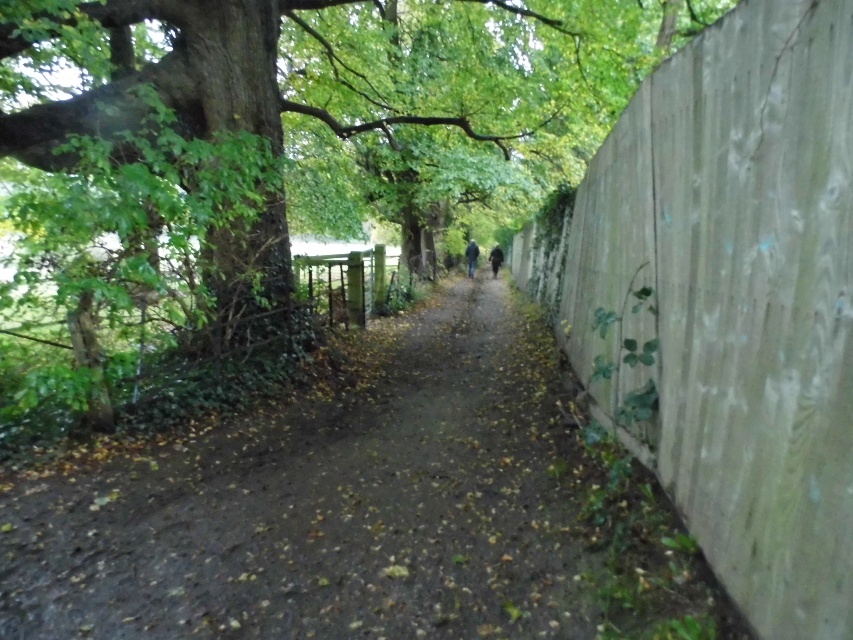
Can you confirm if green leafy tree at upper left is taller than dark gray jacket at center?

Yes.

Who is more forward, (22, 205) or (495, 253)?

Point (22, 205) is more forward.

This screenshot has width=853, height=640. What do you see at coordinates (331, 108) in the screenshot? I see `green leafy tree at upper left` at bounding box center [331, 108].

Locate an element on the screen. green leafy tree at upper left is located at coordinates (331, 108).

Between point (322, 93) and point (473, 241), which one is positioned behind?

The point (473, 241) is more distant.

Locate an element on the screen. The image size is (853, 640). green leafy tree at upper left is located at coordinates (331, 108).

Does dark blue fabric at center have a lesser width compared to dark gray jacket at center?

Correct, dark blue fabric at center's width is less than dark gray jacket at center's.

Can you confirm if dark blue fabric at center is smaller than dark gray jacket at center?

Correct, dark blue fabric at center occupies less space than dark gray jacket at center.

Is point (474, 244) more distant than point (494, 248)?

No, it is not.

Where is `dark blue fabric at center`? The height and width of the screenshot is (640, 853). dark blue fabric at center is located at coordinates (471, 257).